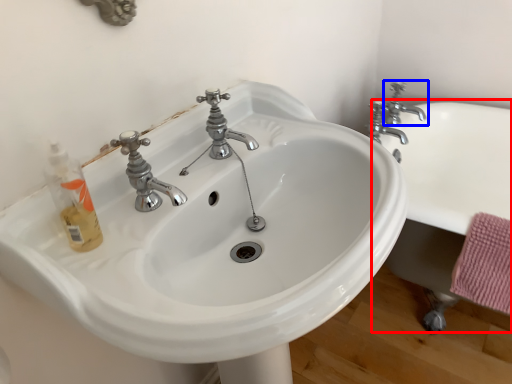
Question: Which object is further to the camera taking this photo, bath (highlighted by a red box) or tap (highlighted by a blue box)?

Choices:
 (A) bath
 (B) tap

Answer: (B)